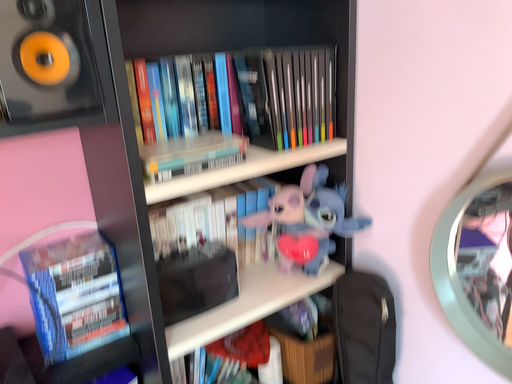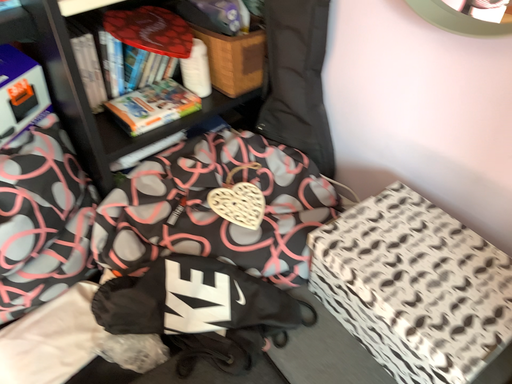
Question: Which way did the camera rotate in the video?

Choices:
 (A) rotated right
 (B) rotated left

Answer: (A)